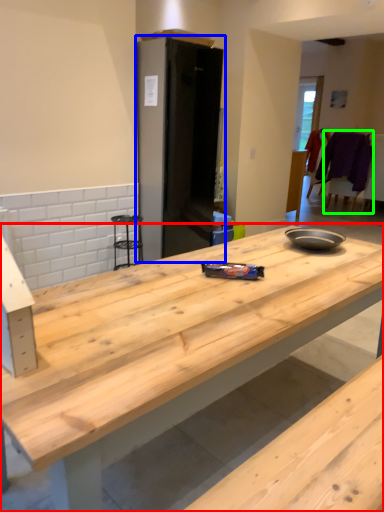
Question: Based on their relative distances, which object is nearer to countertop (highlighted by a red box)? Choose from appliance (highlighted by a blue box) and chair (highlighted by a green box).

Choices:
 (A) appliance
 (B) chair

Answer: (A)